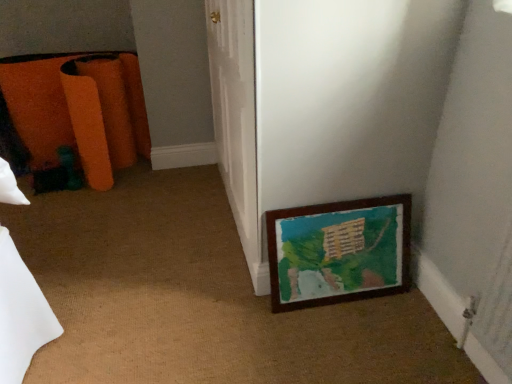
Locate an element on the screen. The width and height of the screenshot is (512, 384). free space in front of wooden picture frame at lower right is located at coordinates (354, 339).